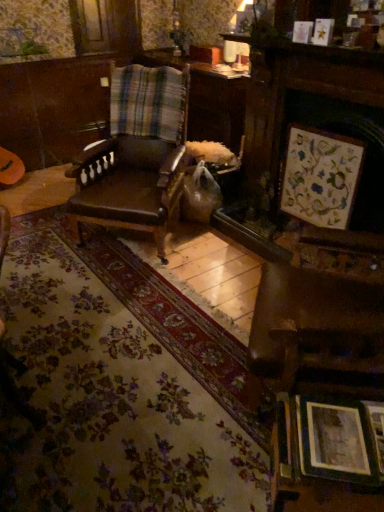
Question: Considering the positions of point (327, 29) and point (306, 173), is point (327, 29) closer or farther from the camera than point (306, 173)?

Choices:
 (A) farther
 (B) closer

Answer: (B)

Question: Considering the positions of wooden picture frame at upper right, which appears as the 4th picture frame when viewed from the front, and wooden framed artwork at upper right, marked as the third picture frame in a front-to-back arrangement, in the image, is wooden picture frame at upper right, which appears as the 4th picture frame when viewed from the front, wider or thinner than wooden framed artwork at upper right, marked as the third picture frame in a front-to-back arrangement,?

Choices:
 (A) thin
 (B) wide

Answer: (A)

Question: Which object is positioned closest to the brown leather chair at center?

Choices:
 (A) plaid fabric at center
 (B) wooden picture frame at lower right, the 5th picture frame positioned from the top
 (C) matte silver picture frame at lower right, which is counted as the fourth picture frame, starting from the back
 (D) wooden picture frame at upper center, which is the first picture frame from top to bottom
 (E) wooden picture frame at upper right, which appears as the 4th picture frame when viewed from the front

Answer: (A)

Question: Estimate the real-world distances between objects in this image. Which object is closer to the plaid fabric at center?

Choices:
 (A) matte silver picture frame at lower right, the second picture frame when ordered from bottom to top
 (B) wooden picture frame at upper right, arranged as the second picture frame when viewed from the top
 (C) wooden picture frame at lower right, the 1th picture frame positioned from the bottom
 (D) wooden framed artwork at upper right, arranged as the third picture frame when viewed from the back
 (E) wooden picture frame at upper center, which is the first picture frame from top to bottom

Answer: (D)